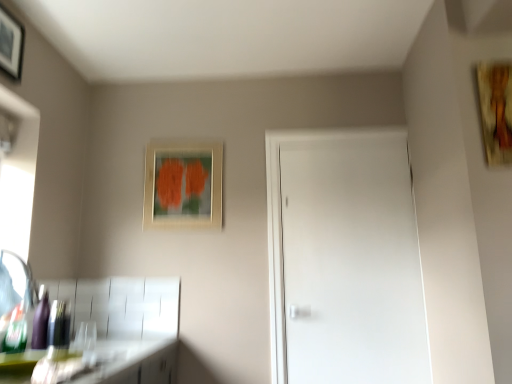
Question: From a real-world perspective, does wooden textured painting at upper right, arranged as the first picture frame when viewed from the right, sit lower than shiny purple bottle at lower left?

Choices:
 (A) no
 (B) yes

Answer: (A)

Question: Does wooden textured painting at upper right, marked as the 3th picture frame in a back-to-front arrangement, have a greater height compared to shiny purple bottle at lower left?

Choices:
 (A) no
 (B) yes

Answer: (B)

Question: Does wooden textured painting at upper right, arranged as the first picture frame when viewed from the right, have a smaller size compared to shiny purple bottle at lower left?

Choices:
 (A) no
 (B) yes

Answer: (A)

Question: Is wooden textured painting at upper right, the first picture frame when ordered from front to back, aimed at shiny purple bottle at lower left?

Choices:
 (A) yes
 (B) no

Answer: (B)

Question: From a real-world perspective, is wooden textured painting at upper right, marked as the 3th picture frame in a back-to-front arrangement, positioned over shiny purple bottle at lower left based on gravity?

Choices:
 (A) yes
 (B) no

Answer: (A)

Question: Is wooden textured painting at upper right, marked as the 3th picture frame in a back-to-front arrangement, to the left of shiny purple bottle at lower left from the viewer's perspective?

Choices:
 (A) no
 (B) yes

Answer: (A)

Question: From a real-world perspective, is wooden picture frame at upper left, the 3th picture frame positioned from the right, physically above brushed metal faucet at lower left?

Choices:
 (A) no
 (B) yes

Answer: (B)

Question: Is wooden picture frame at upper left, placed as the first picture frame when sorted from left to right, positioned behind brushed metal faucet at lower left?

Choices:
 (A) yes
 (B) no

Answer: (A)

Question: From the image's perspective, does wooden picture frame at upper left, which appears as the second picture frame when viewed from the back, appear higher than brushed metal faucet at lower left?

Choices:
 (A) no
 (B) yes

Answer: (B)

Question: Is wooden picture frame at upper left, placed as the first picture frame when sorted from left to right, at the left side of brushed metal faucet at lower left?

Choices:
 (A) no
 (B) yes

Answer: (B)

Question: Is wooden picture frame at upper left, the 3th picture frame positioned from the right, aimed at brushed metal faucet at lower left?

Choices:
 (A) yes
 (B) no

Answer: (B)

Question: Does wooden picture frame at upper left, placed as the first picture frame when sorted from left to right, contain brushed metal faucet at lower left?

Choices:
 (A) yes
 (B) no

Answer: (B)

Question: Does brushed metal faucet at lower left appear on the left side of wooden picture frame at upper left, placed as the first picture frame when sorted from left to right?

Choices:
 (A) yes
 (B) no

Answer: (B)